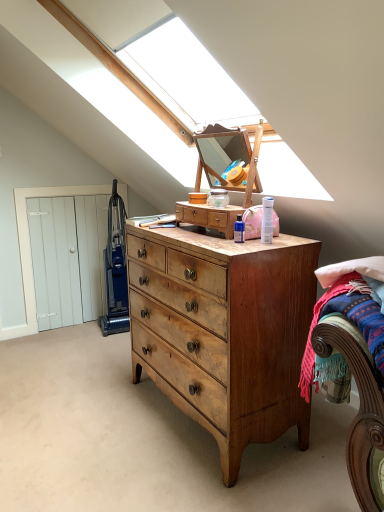
Where is `free point in front of light brown wood chest of drawers at center`? The image size is (384, 512). free point in front of light brown wood chest of drawers at center is located at coordinates (205, 478).